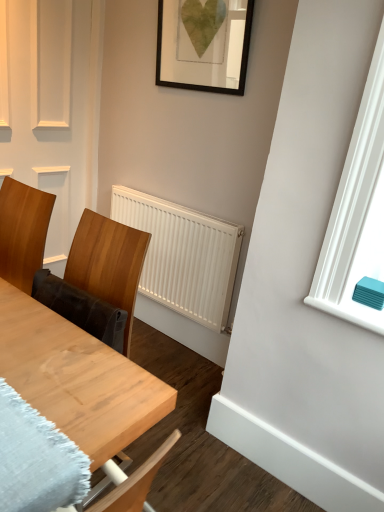
Question: Does white matte radiator at center have a lesser height compared to wooden chair at left?

Choices:
 (A) no
 (B) yes

Answer: (A)

Question: Considering the relative positions of white matte radiator at center and wooden chair at left in the image provided, is white matte radiator at center to the left of wooden chair at left from the viewer's perspective?

Choices:
 (A) no
 (B) yes

Answer: (A)

Question: Considering the relative sizes of white matte radiator at center and wooden chair at left in the image provided, is white matte radiator at center thinner than wooden chair at left?

Choices:
 (A) yes
 (B) no

Answer: (A)

Question: Can you confirm if white matte radiator at center is bigger than wooden chair at left?

Choices:
 (A) no
 (B) yes

Answer: (A)

Question: Is white matte radiator at center smaller than wooden chair at left?

Choices:
 (A) no
 (B) yes

Answer: (B)

Question: Is white matte radiator at center oriented towards wooden chair at left?

Choices:
 (A) yes
 (B) no

Answer: (A)

Question: From a real-world perspective, is white matte radiator at center beneath wooden table at center?

Choices:
 (A) no
 (B) yes

Answer: (B)

Question: Is white matte radiator at center behind wooden table at center?

Choices:
 (A) no
 (B) yes

Answer: (B)

Question: From a real-world perspective, does white matte radiator at center stand above wooden table at center?

Choices:
 (A) yes
 (B) no

Answer: (B)

Question: Considering the relative positions of white matte radiator at center and wooden table at center in the image provided, is white matte radiator at center to the left of wooden table at center from the viewer's perspective?

Choices:
 (A) yes
 (B) no

Answer: (B)

Question: Is white matte radiator at center bigger than wooden table at center?

Choices:
 (A) no
 (B) yes

Answer: (A)

Question: Does white matte radiator at center have a greater height compared to wooden table at center?

Choices:
 (A) no
 (B) yes

Answer: (B)

Question: Is wooden chair at left thinner than wooden table at center?

Choices:
 (A) yes
 (B) no

Answer: (A)